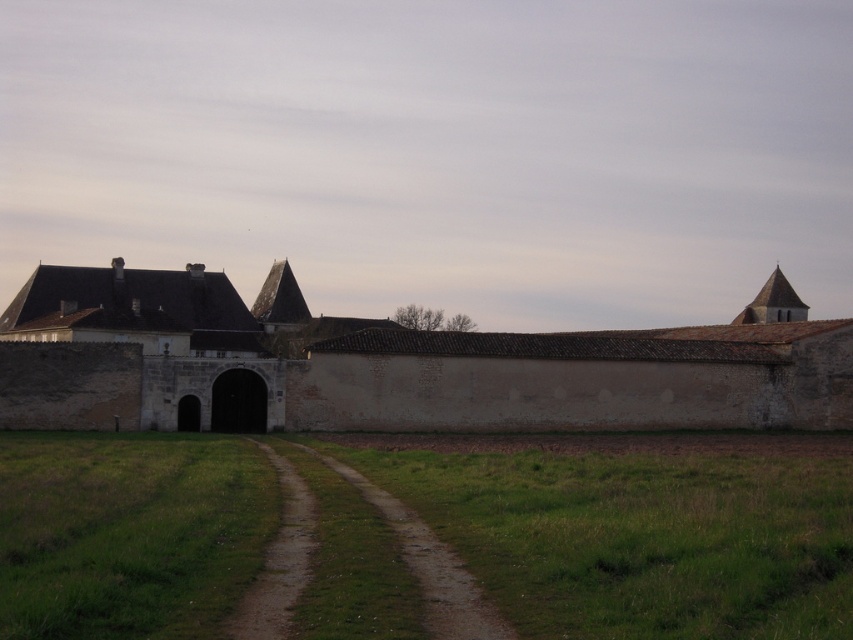
Based on the photo, you are standing in the rural scene and want to walk along the path towards the historic estate. Which object, the brown stone wall at center or the brown dirt track at center, is closer to you as you start your walk?

The brown stone wall at center is closer to you because it is positioned further to the viewer than the brown dirt track at center, meaning you would encounter it first before reaching the dirt track.

Consider the image. You are a visitor approaching the estate and want to walk along the path leading to the main entrance. From your current position, which direction should you head relative to the brown stone wall at center and the brown dirt track at center?

The brown dirt track at center is to the left of the brown stone wall at center. To follow the path towards the main entrance, you should head towards the brown dirt track at center, which is on the left side of the brown stone wall at center.